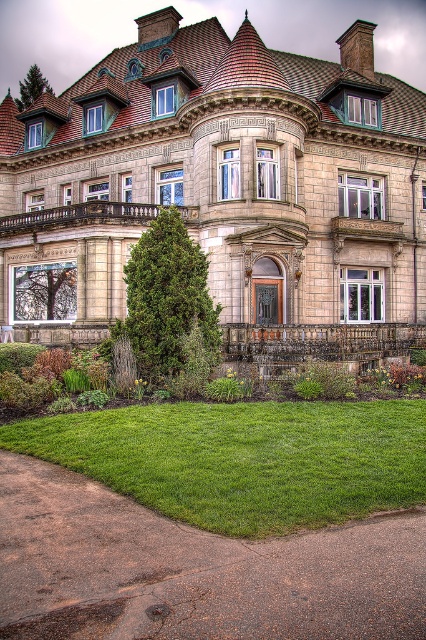
Is beige stone mansion at center to the right of green lawn at lower center from the viewer's perspective?

Indeed, beige stone mansion at center is positioned on the right side of green lawn at lower center.

Does beige stone mansion at center appear on the left side of green lawn at lower center?

In fact, beige stone mansion at center is to the right of green lawn at lower center.

Between point (149, 92) and point (368, 428), which one is positioned in front?

Point (368, 428)

You are a GUI agent. You are given a task and a screenshot of the screen. Output one action in this format:
    pyautogui.click(x=<x>, y=<y>)
    Task: Click on the beige stone mansion at center
    The width and height of the screenshot is (426, 640).
    Given the screenshot: What is the action you would take?
    pyautogui.click(x=221, y=189)